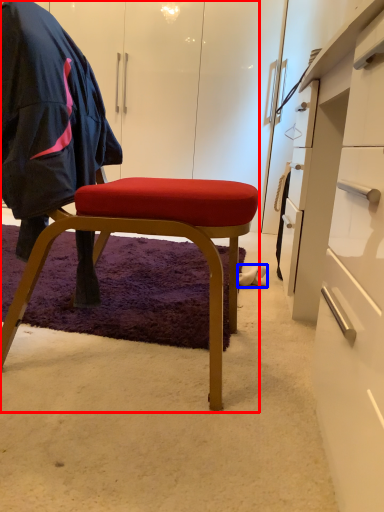
Question: Which object appears closest to the camera in this image, chair (highlighted by a red box) or footwear (highlighted by a blue box)?

Choices:
 (A) chair
 (B) footwear

Answer: (A)